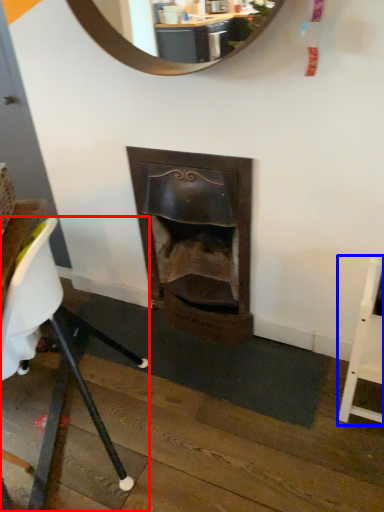
Question: Which point is further to the camera, chair (highlighted by a red box) or chair (highlighted by a blue box)?

Choices:
 (A) chair
 (B) chair

Answer: (B)